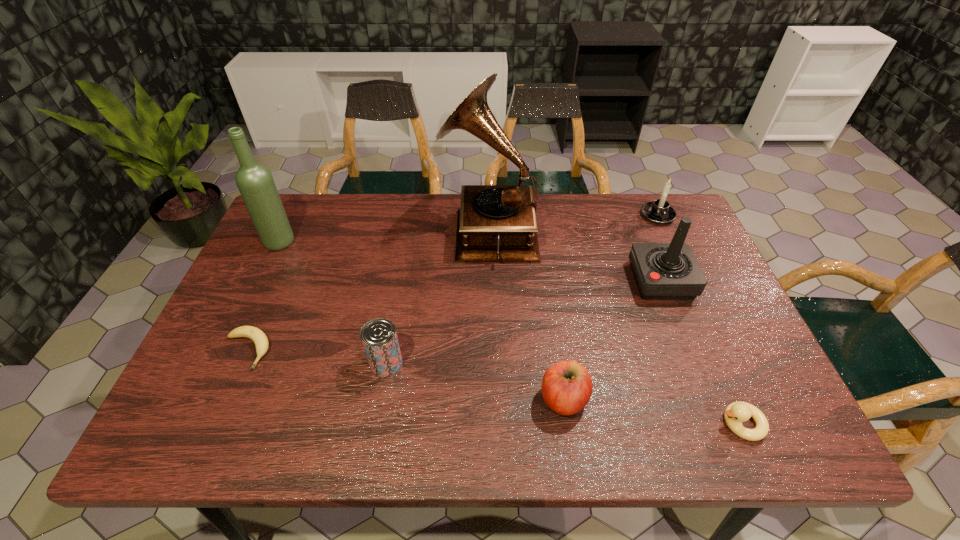
In order to click on vacant area situated 0.370m at the beak of the second shortest object in this screenshot , I will do `click(541, 423)`.

The image size is (960, 540). In order to click on free region located 0.210m on the back of the banana in this screenshot , I will do `click(281, 271)`.

Locate an element on the screen. Image resolution: width=960 pixels, height=540 pixels. record player at the far edge is located at coordinates (495, 223).

Where is `wine bottle located in the far edge section of the desktop`? The height and width of the screenshot is (540, 960). wine bottle located in the far edge section of the desktop is located at coordinates (255, 182).

Locate an element on the screen. The height and width of the screenshot is (540, 960). candle holder located at the far edge is located at coordinates (659, 211).

Where is `apple that is at the near edge`? This screenshot has width=960, height=540. apple that is at the near edge is located at coordinates (567, 386).

Locate an element on the screen. This screenshot has height=540, width=960. duckling positioned at the near edge is located at coordinates (735, 413).

Where is `wine bottle positioned at the left edge`? This screenshot has width=960, height=540. wine bottle positioned at the left edge is located at coordinates (255, 182).

The width and height of the screenshot is (960, 540). In order to click on banana at the left edge in this screenshot , I will do `click(259, 338)`.

Identify the location of joystick that is positioned at the right edge. The image size is (960, 540). (663, 271).